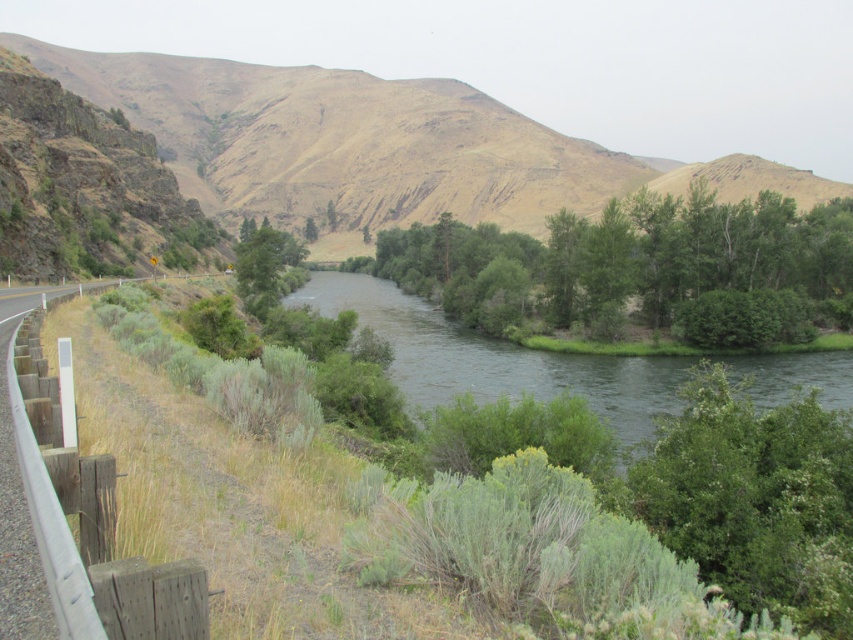
Can you confirm if green leafy trees at center is wider than green leafy river at center?

Indeed, green leafy trees at center has a greater width compared to green leafy river at center.

Can you confirm if green leafy trees at center is taller than green leafy river at center?

Indeed, green leafy trees at center has a greater height compared to green leafy river at center.

Find the location of `green leafy trees at center`. green leafy trees at center is located at coordinates [x=637, y=268].

Which is in front, point (99, 77) or point (358, 280)?

Positioned in front is point (358, 280).

Can you confirm if brown/drymountain at upper center is positioned to the right of green leafy river at center?

No, brown/drymountain at upper center is not to the right of green leafy river at center.

The height and width of the screenshot is (640, 853). What do you see at coordinates (376, 147) in the screenshot?
I see `brown/drymountain at upper center` at bounding box center [376, 147].

Identify the location of brown/drymountain at upper center. This screenshot has height=640, width=853. (376, 147).

Who is positioned more to the left, green leafy river at center or green leafy tree at center?

Positioned to the left is green leafy tree at center.

Can you confirm if green leafy river at center is thinner than green leafy tree at center?

No, green leafy river at center is not thinner than green leafy tree at center.

Measure the distance between point (320,300) and camera.

Point (320,300) and camera are 499.85 feet apart.

You are a GUI agent. You are given a task and a screenshot of the screen. Output one action in this format:
    pyautogui.click(x=<x>, y=<y>)
    Task: Click on the green leafy river at center
    
    Given the screenshot: What is the action you would take?
    coord(494,356)